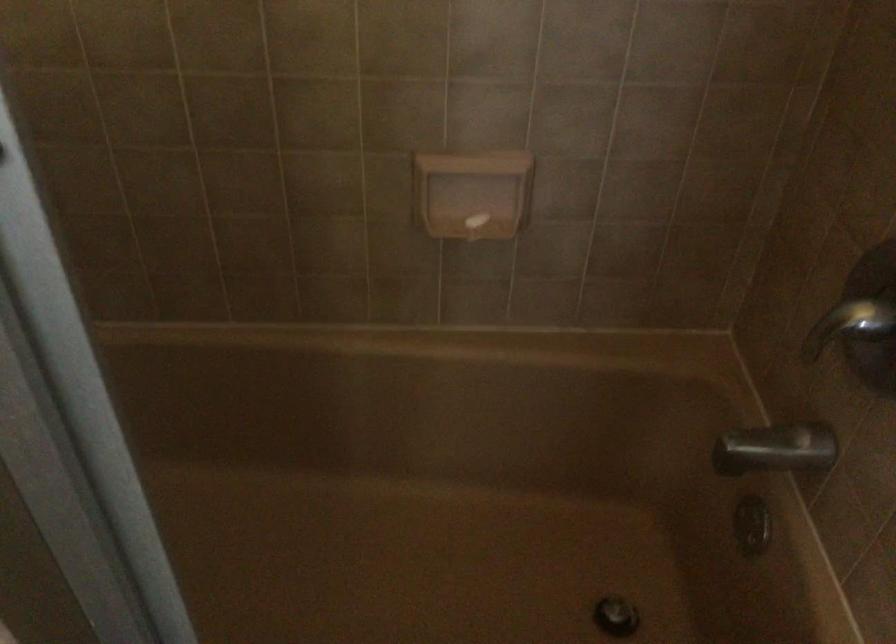
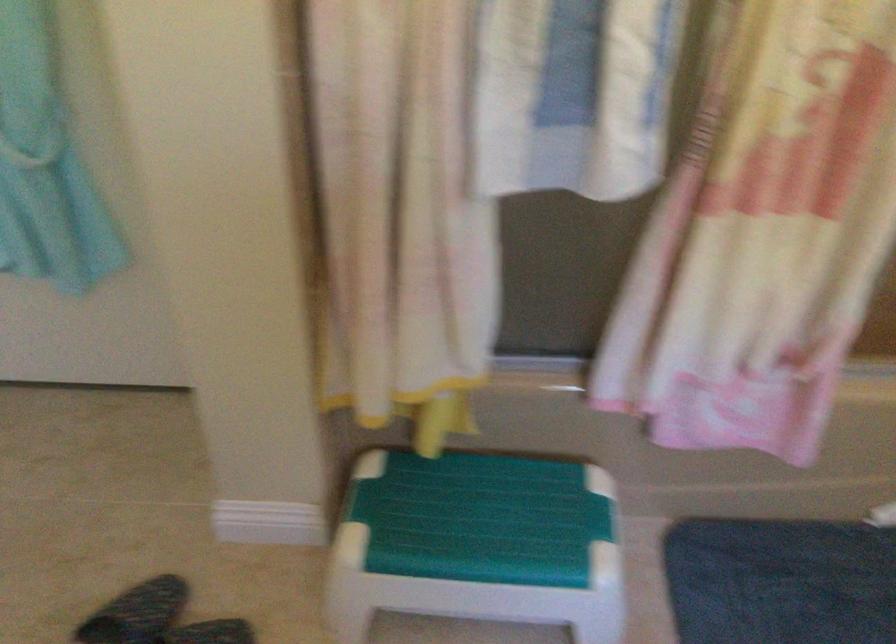
The images are taken continuously from a first-person perspective. In which direction are you moving?

The cameraman walked toward left, backward.